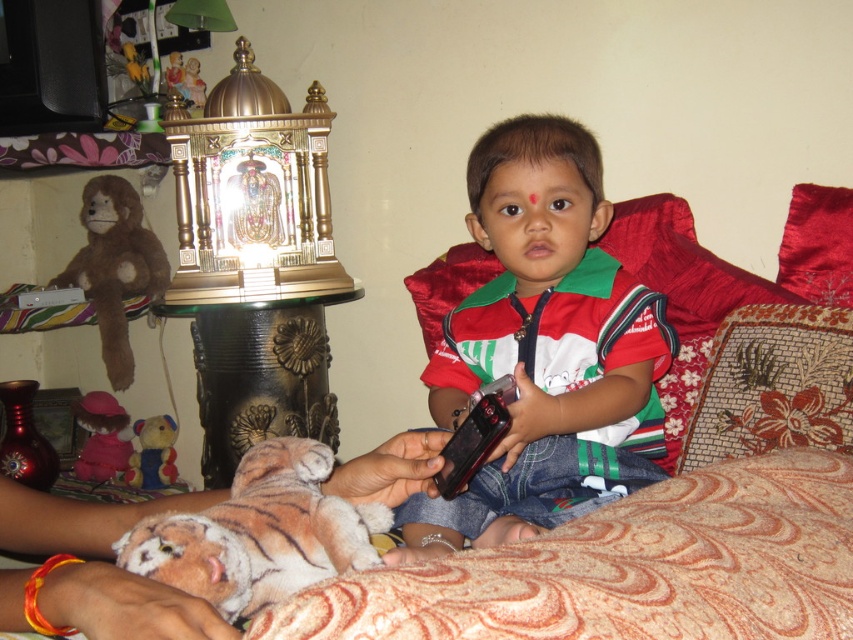
You are organizing a childrens party and need to place a small sticker on either the brown plush monkey at left or the velvety brown teddy bear at lower left. Which toy would you choose to ensure the sticker is more visible due to its size?

The brown plush monkey at left has a larger size compared to the velvety brown teddy bear at lower left, so the sticker would be more visible on the brown plush monkey at left.

You are a toy organizer who needs to arrange the brown plush monkey at left and the velvet plush toy at lower left on a shelf. If the shelf can only hold items up to the size of the smaller toy, which one cannot be placed on the shelf?

The brown plush monkey at left cannot be placed on the shelf because it is bigger than the velvet plush toy at lower left, which is the size limit for the shelf.